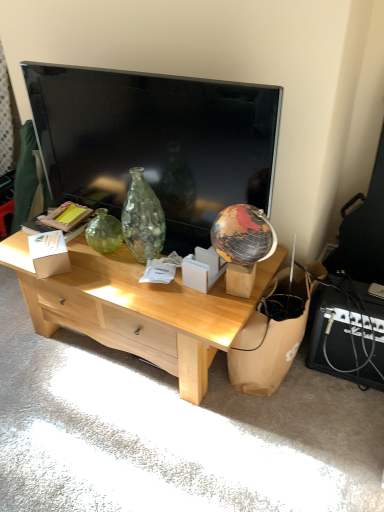
This screenshot has height=512, width=384. What are the coordinates of `vacant space in between white cardboard box at center, which is the 2th cardboard box in left-to-right order, and white cardboard box at center, which is the first cardboard box from left to right` in the screenshot? It's located at click(111, 266).